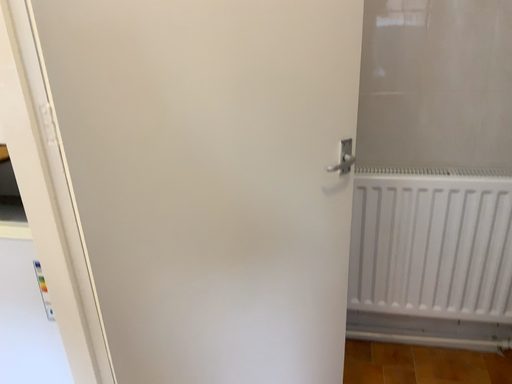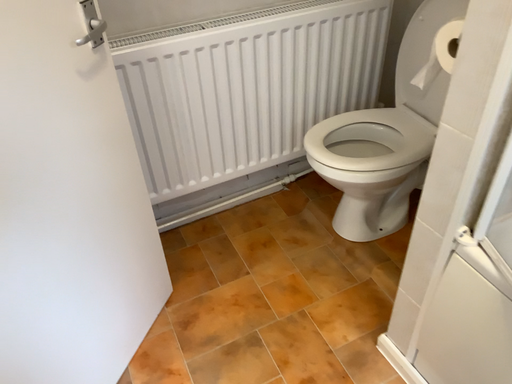
Question: Which way did the camera rotate in the video?

Choices:
 (A) rotated left
 (B) rotated right

Answer: (B)